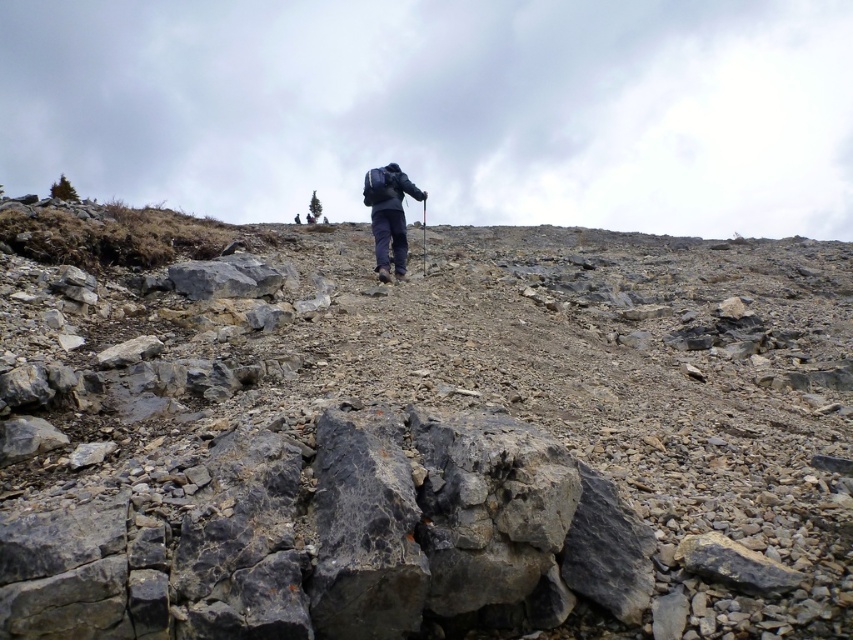
Question: Among these points, which one is nearest to the camera?

Choices:
 (A) (292, 276)
 (B) (383, 186)

Answer: (A)

Question: Among these objects, which one is farthest from the camera?

Choices:
 (A) dark blue fabric backpack at center
 (B) gray rocky hillside at center

Answer: (A)

Question: Can you confirm if gray rocky hillside at center is wider than dark blue fabric backpack at center?

Choices:
 (A) yes
 (B) no

Answer: (A)

Question: Is gray rocky hillside at center above dark blue fabric backpack at center?

Choices:
 (A) yes
 (B) no

Answer: (B)

Question: Is gray rocky hillside at center in front of dark blue fabric backpack at center?

Choices:
 (A) yes
 (B) no

Answer: (A)